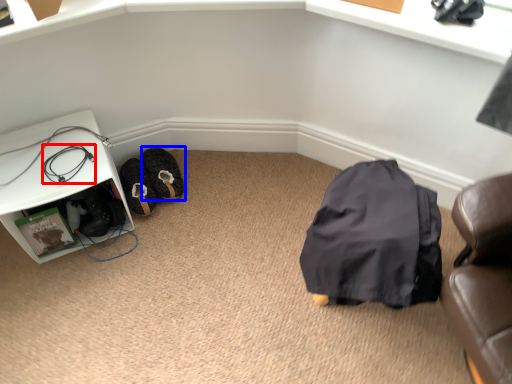
Question: Which object is further to the camera taking this photo, wire (highlighted by a red box) or footwear (highlighted by a blue box)?

Choices:
 (A) wire
 (B) footwear

Answer: (B)